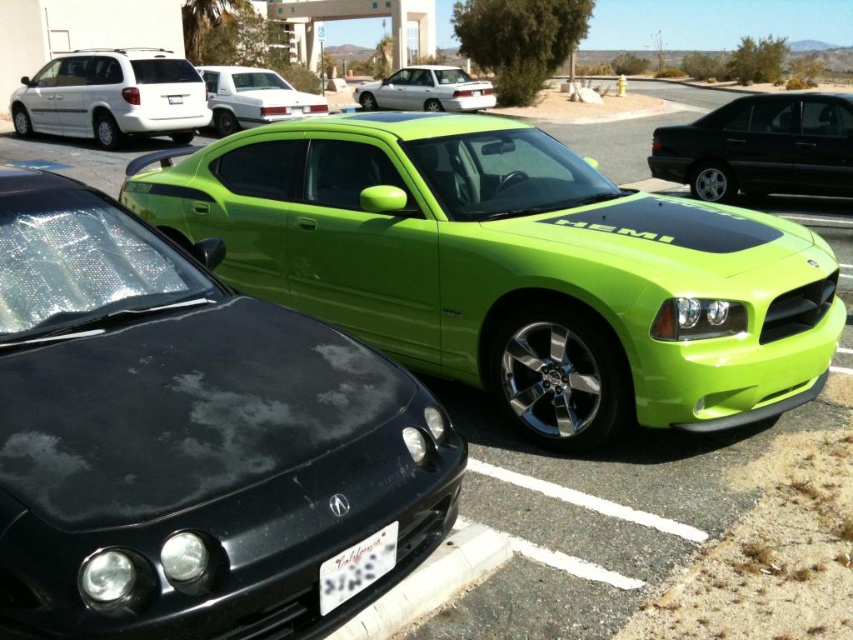
Question: Can you confirm if lime green matte car at center is thinner than lime green metallic car at center?

Choices:
 (A) yes
 (B) no

Answer: (A)

Question: Which object appears farthest from the camera in this image?

Choices:
 (A) white plastic license plate at center
 (B) white glossy sedan at upper center

Answer: (B)

Question: Which object appears closest to the camera in this image?

Choices:
 (A) white glossy sedan at upper center
 (B) lime green matte car at center
 (C) glossy black sedan at right
 (D) white matte minivan at upper left

Answer: (B)

Question: Can you confirm if lime green matte car at center is positioned above white matte minivan at upper left?

Choices:
 (A) no
 (B) yes

Answer: (A)

Question: Which point is farther to the camera?

Choices:
 (A) white matte minivan at upper left
 (B) lime green matte car at center

Answer: (A)

Question: In this image, where is lime green metallic car at center located relative to silver metallic station wagon at center?

Choices:
 (A) left
 (B) right

Answer: (B)